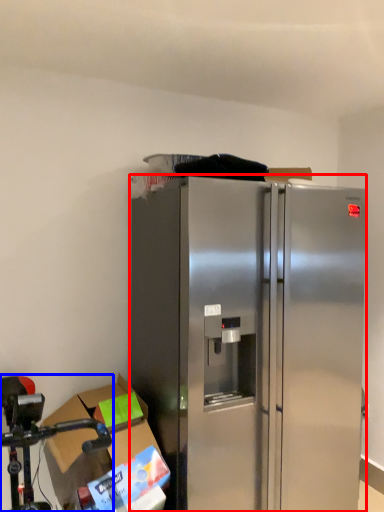
Question: Which object appears closest to the camera in this image, refrigerator (highlighted by a red box) or stainless steel (highlighted by a blue box)?

Choices:
 (A) refrigerator
 (B) stainless steel

Answer: (B)